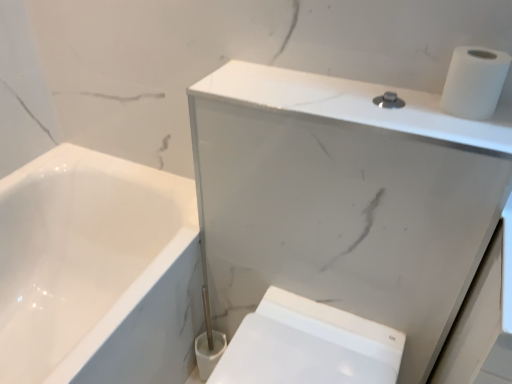
Question: Does white marble cabinet at upper right have a greater height compared to white glossy bidet at lower right?

Choices:
 (A) no
 (B) yes

Answer: (B)

Question: Does white marble cabinet at upper right have a larger size compared to white glossy bidet at lower right?

Choices:
 (A) yes
 (B) no

Answer: (A)

Question: From a real-world perspective, is white marble cabinet at upper right beneath white glossy bidet at lower right?

Choices:
 (A) yes
 (B) no

Answer: (B)

Question: Does white marble cabinet at upper right have a lesser height compared to white glossy bidet at lower right?

Choices:
 (A) no
 (B) yes

Answer: (A)

Question: Does white marble cabinet at upper right have a smaller size compared to white glossy bidet at lower right?

Choices:
 (A) yes
 (B) no

Answer: (B)

Question: In terms of width, does white glossy bidet at lower right look wider or thinner when compared to white matte toilet paper at upper right?

Choices:
 (A) thin
 (B) wide

Answer: (B)

Question: Does point (354, 374) appear closer or farther from the camera than point (494, 67)?

Choices:
 (A) closer
 (B) farther

Answer: (B)

Question: From a real-world perspective, is white glossy bidet at lower right positioned above or below white matte toilet paper at upper right?

Choices:
 (A) below
 (B) above

Answer: (A)

Question: In terms of height, does white glossy bidet at lower right look taller or shorter compared to white matte toilet paper at upper right?

Choices:
 (A) short
 (B) tall

Answer: (B)

Question: From the image's perspective, is white matte toilet paper at upper right positioned above or below white marble cabinet at upper right?

Choices:
 (A) below
 (B) above

Answer: (B)

Question: Is white matte toilet paper at upper right wider or thinner than white marble cabinet at upper right?

Choices:
 (A) thin
 (B) wide

Answer: (A)

Question: Is white matte toilet paper at upper right inside the boundaries of white marble cabinet at upper right, or outside?

Choices:
 (A) inside
 (B) outside

Answer: (B)

Question: Looking at the image, does white matte toilet paper at upper right seem bigger or smaller compared to white marble cabinet at upper right?

Choices:
 (A) small
 (B) big

Answer: (A)

Question: Considering the relative positions of white matte toilet paper at upper right and white glossy bidet at lower right in the image provided, is white matte toilet paper at upper right to the left or to the right of white glossy bidet at lower right?

Choices:
 (A) right
 (B) left

Answer: (A)

Question: Relative to white glossy bidet at lower right, is white matte toilet paper at upper right in front or behind?

Choices:
 (A) front
 (B) behind

Answer: (A)